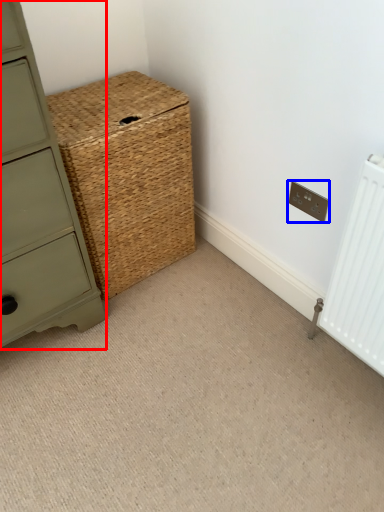
Question: Which object appears farthest to the camera in this image, chest of drawers (highlighted by a red box) or electric outlet (highlighted by a blue box)?

Choices:
 (A) chest of drawers
 (B) electric outlet

Answer: (B)